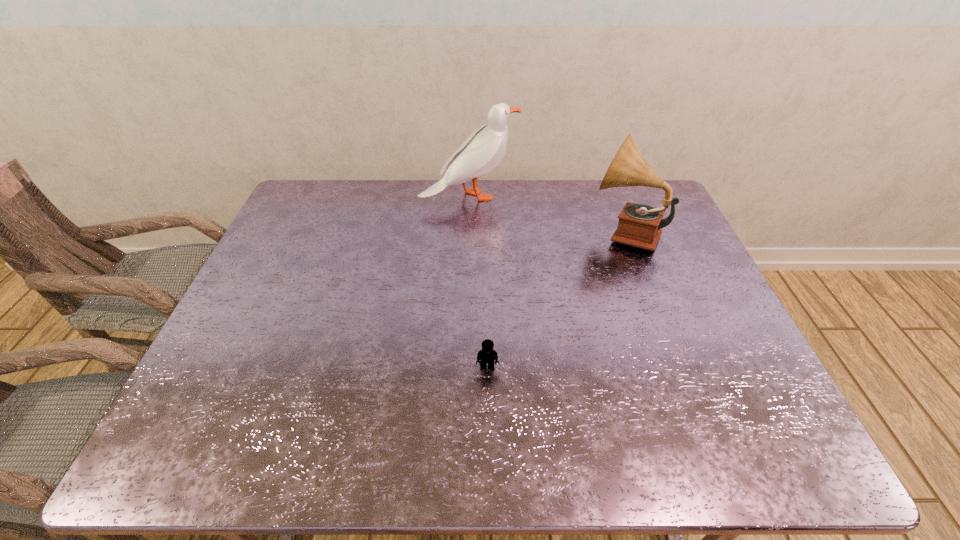
At what (x,y) coordinates should I click in order to perform the action: click on free space that satisfies the following two spatial constraints: 1. on the horn of the rightmost object; 2. on the front-facing side of the shortest object. Please return your answer as a coordinate pair (x, y). This screenshot has width=960, height=540. Looking at the image, I should click on (675, 367).

In order to click on free location that satisfies the following two spatial constraints: 1. on the horn of the phonograph record; 2. on the front-facing side of the shortest object in this screenshot , I will do `click(675, 367)`.

Identify the location of free space that satisfies the following two spatial constraints: 1. on the horn of the phonograph record; 2. on the front-facing side of the shortest object. This screenshot has width=960, height=540. (675, 367).